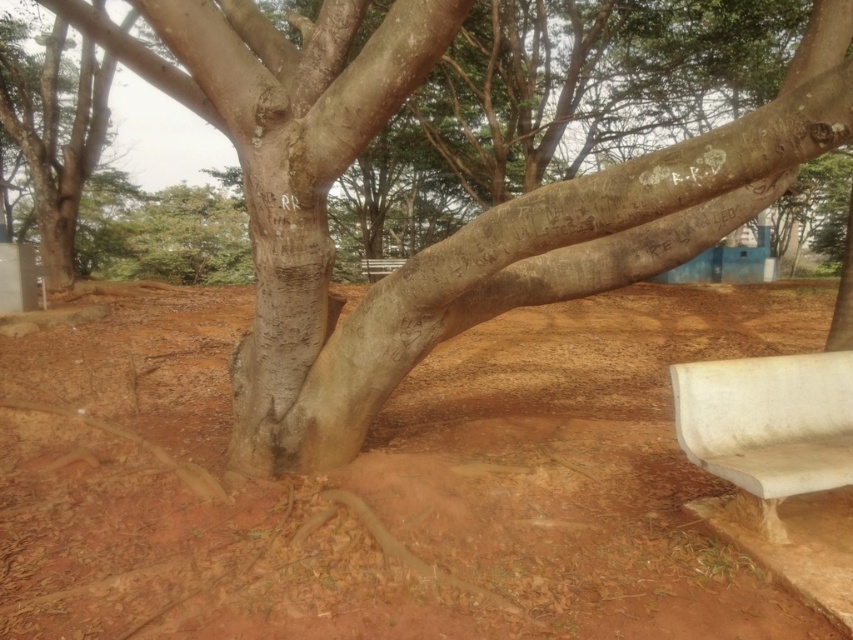
You are standing at the bottom of the tree and want to place a small garden gnome exactly where the brown soil at center is located. According to the coordinates provided, what are the exact coordinates where you should place the gnome?

The exact coordinates for placing the gnome at the brown soil at center are 0.752 in the x direction and 0.454 in the y direction.

You are planning to sit on one of the benches in the park. Which bench is closer to the tree? The white marble bench at lower right or the white plastic bench at center?

The white plastic bench at center is closer to the tree because the white marble bench at lower right is positioned to its right, meaning it is further away from the tree.

You are standing at the point marked by point (454,232). Looking around, you see a smooth bark tree at center. Which direction should you walk to reach the curved concrete bench on the right side of the frame?

The curved concrete bench on the right side of the frame is located to the right of the smooth bark tree at center, so you should walk towards the right to reach it.